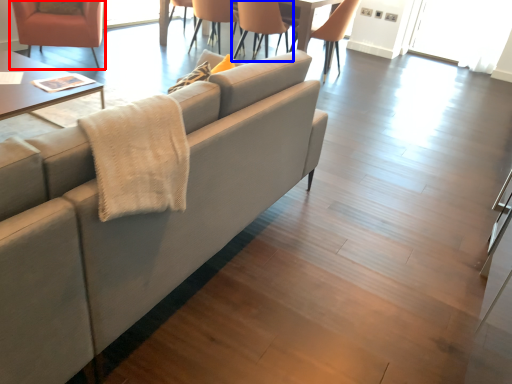
Question: Which object appears farthest to the camera in this image, chair (highlighted by a red box) or chair (highlighted by a blue box)?

Choices:
 (A) chair
 (B) chair

Answer: (B)